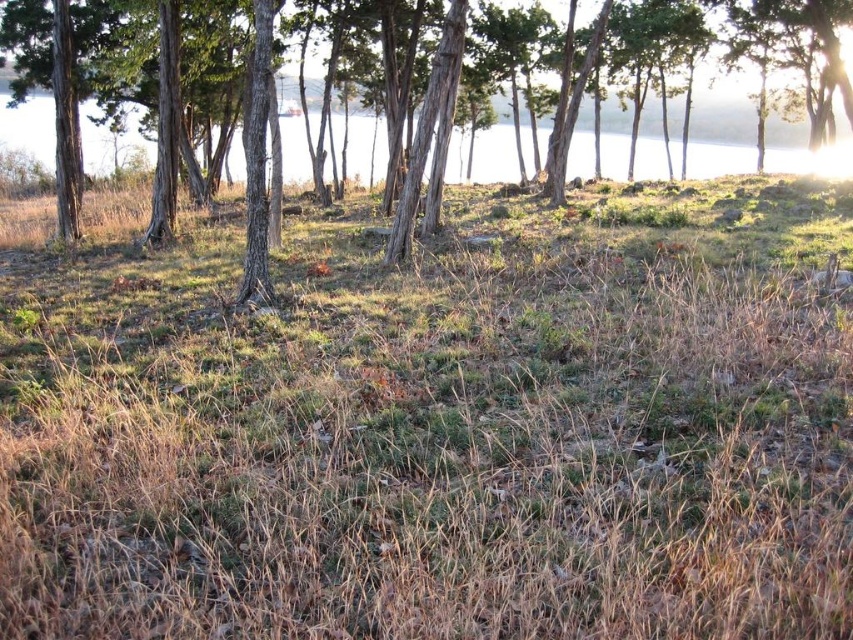
In the scene shown: You are standing at the center of the image and want to place a small decorative rock exactly at the location of the brown dry grass at center. According to the coordinates provided, where should you place the rock?

The brown dry grass at center is located at point (440, 426), so you should place the rock at those coordinates.

You are standing at the point marked by coordinates [440,426] in the image. What is the primary type of vegetation you would see around you?

The primary vegetation around the point [440,426] is brown dry grass at center.